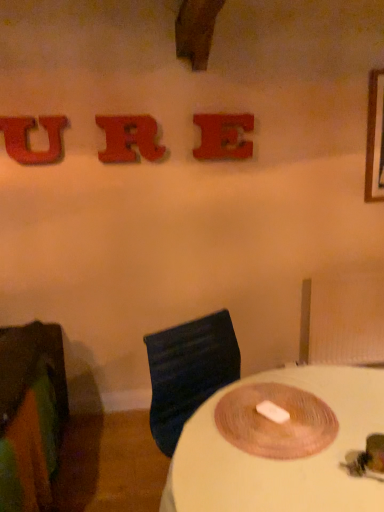
Question: Is point (127, 117) closer or farther from the camera than point (326, 369)?

Choices:
 (A) farther
 (B) closer

Answer: (A)

Question: From their relative heights in the image, would you say rubberized red letter r at upper center, which is counted as the 2th alphabet, starting from the left, is taller or shorter than white matte table at center?

Choices:
 (A) tall
 (B) short

Answer: (B)

Question: Which is nearer to the green fabric chair at left?

Choices:
 (A) rubberized red letter r at upper center, which is counted as the 2th alphabet, starting from the left
 (B) white matte table at center
 (C) matte red letter e at upper center, the third alphabet from the left
 (D) glittery red letter u at upper left, which appears as the third alphabet when viewed from the right

Answer: (B)

Question: Which object is the closest to the rubberized red letter r at upper center, which is counted as the 2th alphabet, starting from the left?

Choices:
 (A) matte red letter e at upper center, marked as the 1th alphabet in a right-to-left arrangement
 (B) glittery red letter u at upper left, which appears as the third alphabet when viewed from the right
 (C) white matte table at center
 (D) green fabric chair at left

Answer: (B)